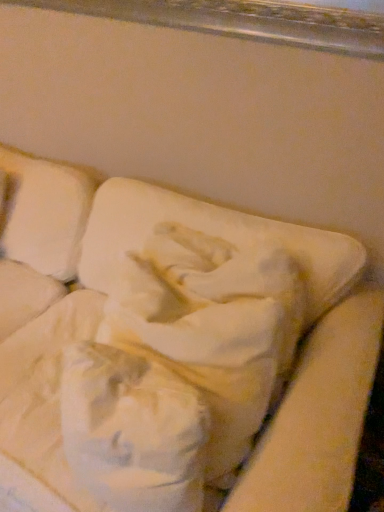
Question: From a real-world perspective, is white fabric cushion at center physically below white soft pillow at center?

Choices:
 (A) yes
 (B) no

Answer: (A)

Question: Is white fabric cushion at center smaller than white soft pillow at center?

Choices:
 (A) no
 (B) yes

Answer: (A)

Question: From the image's perspective, is white fabric cushion at center located above white soft pillow at center?

Choices:
 (A) yes
 (B) no

Answer: (B)

Question: Considering the relative sizes of white fabric cushion at center and white soft pillow at center in the image provided, is white fabric cushion at center shorter than white soft pillow at center?

Choices:
 (A) yes
 (B) no

Answer: (B)

Question: Does white fabric cushion at center have a greater width compared to white soft pillow at center?

Choices:
 (A) yes
 (B) no

Answer: (A)

Question: Is white fabric cushion at center positioned with its back to white soft pillow at center?

Choices:
 (A) no
 (B) yes

Answer: (B)

Question: From the image's perspective, would you say white soft pillow at center is shown under white fabric cushion at center?

Choices:
 (A) yes
 (B) no

Answer: (B)

Question: Is white soft pillow at center positioned with its back to white fabric cushion at center?

Choices:
 (A) yes
 (B) no

Answer: (A)

Question: Is white soft pillow at center at the right side of white fabric cushion at center?

Choices:
 (A) yes
 (B) no

Answer: (A)

Question: Does white soft pillow at center appear on the left side of white fabric cushion at center?

Choices:
 (A) no
 (B) yes

Answer: (A)

Question: Are white soft pillow at center and white fabric cushion at center making contact?

Choices:
 (A) no
 (B) yes

Answer: (A)

Question: Does white soft pillow at center come in front of white fabric cushion at center?

Choices:
 (A) no
 (B) yes

Answer: (A)

Question: Is white soft pillow at center wider or thinner than white fabric cushion at center?

Choices:
 (A) thin
 (B) wide

Answer: (A)